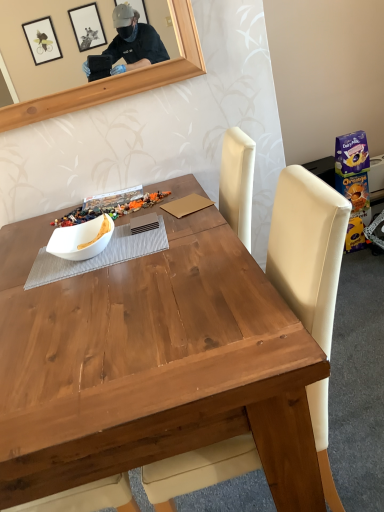
Question: Does white matte bowl at center contain wooden chair at center?

Choices:
 (A) yes
 (B) no

Answer: (B)

Question: Considering the relative positions of white matte bowl at center and wooden chair at center in the image provided, is white matte bowl at center in front of wooden chair at center?

Choices:
 (A) no
 (B) yes

Answer: (A)

Question: Can you confirm if white matte bowl at center is positioned to the right of wooden chair at center?

Choices:
 (A) no
 (B) yes

Answer: (A)

Question: Is white matte bowl at center not inside wooden chair at center?

Choices:
 (A) no
 (B) yes

Answer: (B)

Question: From a real-world perspective, is white matte bowl at center below wooden chair at center?

Choices:
 (A) no
 (B) yes

Answer: (A)

Question: From a real-world perspective, relative to wooden chair at center, is white matte bowl at center vertically above or below?

Choices:
 (A) below
 (B) above

Answer: (B)

Question: Is point tap(69, 241) positioned closer to the camera than point tap(241, 450)?

Choices:
 (A) farther
 (B) closer

Answer: (A)

Question: In the image, is white matte bowl at center positioned in front of or behind wooden chair at center?

Choices:
 (A) front
 (B) behind

Answer: (B)

Question: Is white matte bowl at center situated inside wooden chair at center or outside?

Choices:
 (A) inside
 (B) outside

Answer: (B)

Question: Is white matte bowl at center situated inside white matte bowl at center or outside?

Choices:
 (A) inside
 (B) outside

Answer: (B)

Question: From a real-world perspective, is white matte bowl at center above or below white matte bowl at center?

Choices:
 (A) below
 (B) above

Answer: (A)

Question: Does point (81, 233) appear closer or farther from the camera than point (54, 238)?

Choices:
 (A) closer
 (B) farther

Answer: (A)

Question: Based on their sizes in the image, would you say white matte bowl at center is bigger or smaller than white matte bowl at center?

Choices:
 (A) small
 (B) big

Answer: (B)

Question: Do you think wooden chair at center is within white matte bowl at center, or outside of it?

Choices:
 (A) inside
 (B) outside

Answer: (B)

Question: Relative to white matte bowl at center, is wooden chair at center in front or behind?

Choices:
 (A) behind
 (B) front

Answer: (B)